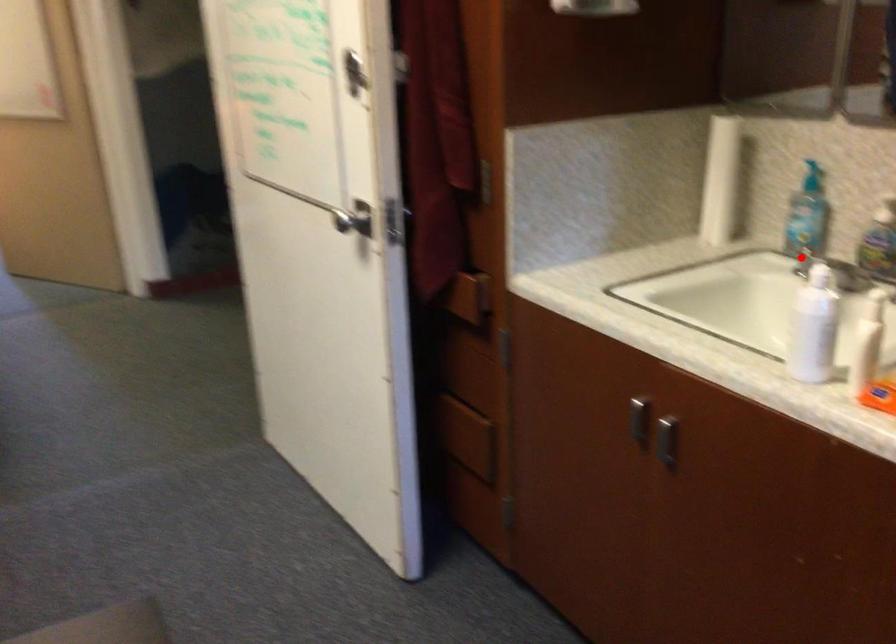
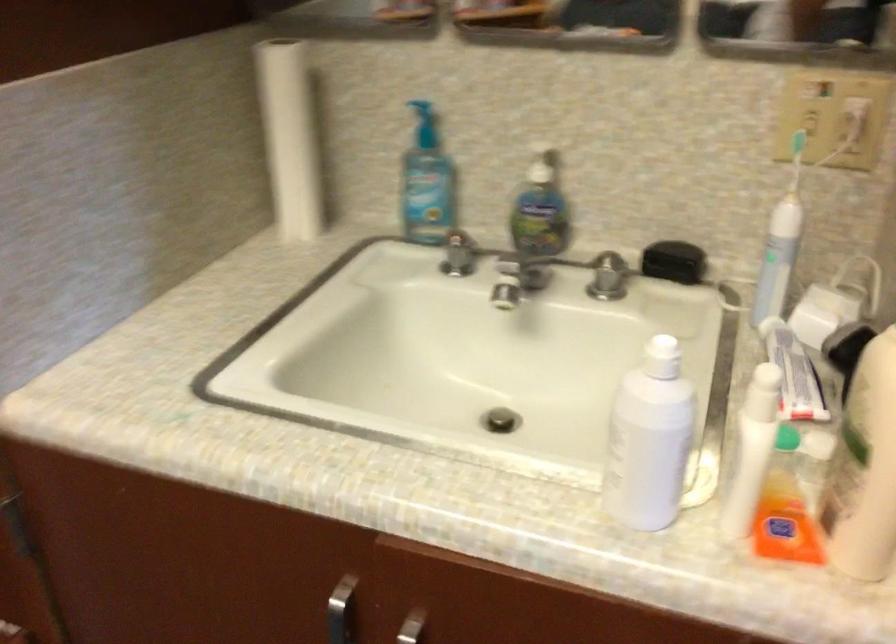
Question: I am providing you with two images of the same scene from different viewpoints. Image1 has a red point marked. In image2, the corresponding 3D location appears at what relative position? Reply with the corresponding letter.

Choices:
 (A) Closer
 (B) Farther

Answer: (A)